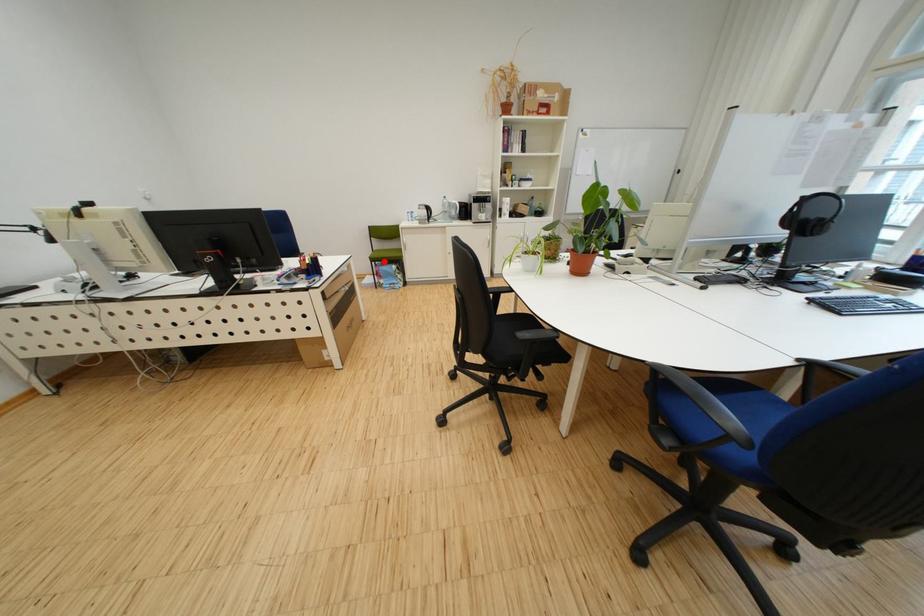
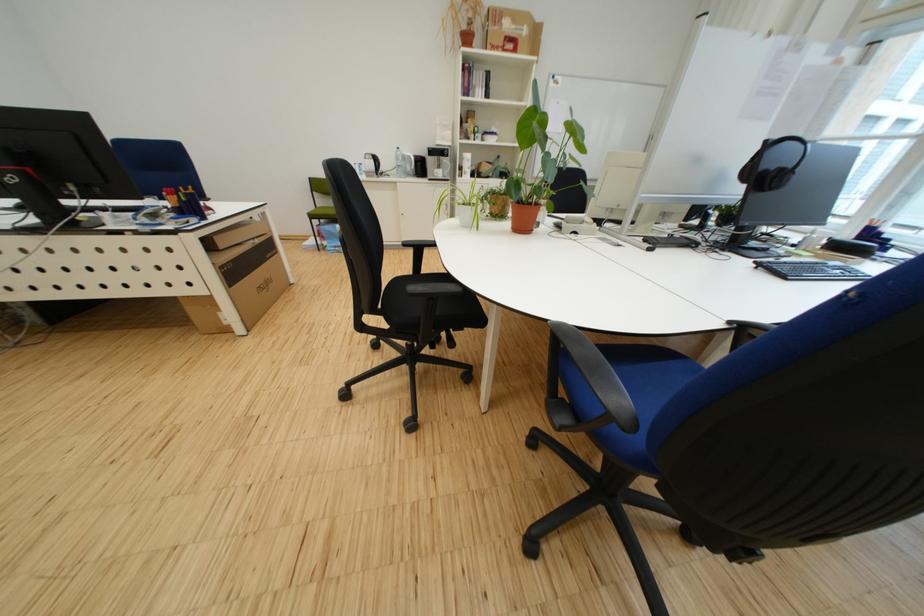
In the second image, find the point that corresponds to the highlighted location in the first image.

(323, 219)